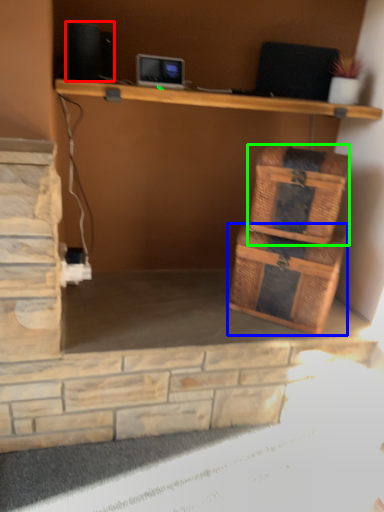
Question: Which object is positioned farthest from speaker (highlighted by a red box)? Select from storage box (highlighted by a blue box) and basket (highlighted by a green box).

Choices:
 (A) storage box
 (B) basket

Answer: (A)